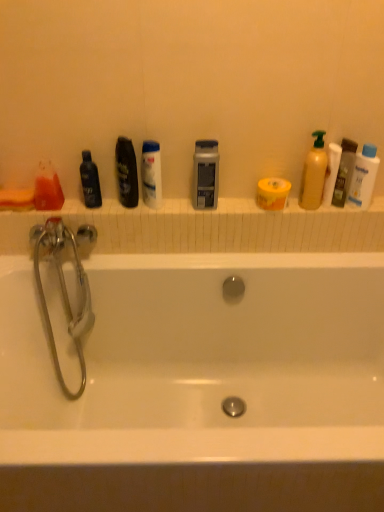
Image resolution: width=384 pixels, height=512 pixels. What do you see at coordinates (90, 181) in the screenshot?
I see `black glossy mouthwash at left, which is counted as the second mouthwash, starting from the left` at bounding box center [90, 181].

This screenshot has height=512, width=384. What are the coordinates of `white plastic baby lotion at upper right, acting as the second cleaning product starting from the left` in the screenshot? It's located at (363, 177).

I want to click on silver metallic faucet at left, so click(x=63, y=292).

Would you say matte yellow bottle at right, acting as the 2th cleaning product starting from the right, is outside satin silver mouthwash at center, the second mouthwash viewed from the right?

Yes.

Is matte yellow bottle at right, acting as the 2th cleaning product starting from the right, looking in the opposite direction of satin silver mouthwash at center, the second mouthwash viewed from the right?

No, satin silver mouthwash at center, the second mouthwash viewed from the right, is not at the back of matte yellow bottle at right, acting as the 2th cleaning product starting from the right.

Which object is closer to the camera, matte yellow bottle at right, the first cleaning product viewed from the left, or satin silver mouthwash at center, the second mouthwash viewed from the right?

Positioned in front is matte yellow bottle at right, the first cleaning product viewed from the left.

Is point (309, 163) positioned in front of point (205, 192)?

Yes, point (309, 163) is closer to viewer.

Which of these two, black glossy mouthwash at left, which is counted as the second mouthwash, starting from the left, or translucent plastic mouthwash at right, acting as the 6th mouthwash starting from the left, is bigger?

translucent plastic mouthwash at right, acting as the 6th mouthwash starting from the left, is bigger.

Find the location of a particular element. This screenshot has height=512, width=384. the 1st mouthwash in front of the black glossy mouthwash at left, which appears as the fifth mouthwash when viewed from the right is located at coordinates (344, 172).

From the image's perspective, which is below, black glossy mouthwash at left, which is counted as the second mouthwash, starting from the left, or translucent plastic mouthwash at right, acting as the 6th mouthwash starting from the left?

black glossy mouthwash at left, which is counted as the second mouthwash, starting from the left, from the image's perspective.

Who is more distant, black glossy mouthwash at left, which appears as the fifth mouthwash when viewed from the right, or translucent plastic mouthwash at right, the first mouthwash in the right-to-left sequence?

black glossy mouthwash at left, which appears as the fifth mouthwash when viewed from the right, is further from the camera.

From the image's perspective, is black matte bottle at center, the 3th mouthwash from the left, below silver metallic faucet at left?

Actually, black matte bottle at center, the 3th mouthwash from the left, appears above silver metallic faucet at left in the image.

Is black matte bottle at center, the 3th mouthwash from the left, wider or thinner than silver metallic faucet at left?

Considering their sizes, black matte bottle at center, the 3th mouthwash from the left, looks slimmer than silver metallic faucet at left.

Is black matte bottle at center, the 3th mouthwash from the left, inside the boundaries of silver metallic faucet at left, or outside?

black matte bottle at center, the 3th mouthwash from the left, exists outside the volume of silver metallic faucet at left.

Is matte yellow bottle at right, the first cleaning product viewed from the left, facing away from translucent plastic mouthwash at right, the first mouthwash in the right-to-left sequence?

matte yellow bottle at right, the first cleaning product viewed from the left, is not turned away from translucent plastic mouthwash at right, the first mouthwash in the right-to-left sequence.

Considering the relative sizes of matte yellow bottle at right, the first cleaning product viewed from the left, and translucent plastic mouthwash at right, the first mouthwash in the right-to-left sequence, in the image provided, is matte yellow bottle at right, the first cleaning product viewed from the left, taller than translucent plastic mouthwash at right, the first mouthwash in the right-to-left sequence,?

Indeed, matte yellow bottle at right, the first cleaning product viewed from the left, has a greater height compared to translucent plastic mouthwash at right, the first mouthwash in the right-to-left sequence.

How distant is matte yellow bottle at right, acting as the 2th cleaning product starting from the right, from translucent plastic mouthwash at right, acting as the 6th mouthwash starting from the left?

They are 9.31 centimeters apart.

Which is more distant, (x=317, y=198) or (x=346, y=142)?

The point (x=317, y=198) is behind.

Considering the sizes of black matte bottle at center, the 3th mouthwash from the left, and translucent orange liquid at left, the 6th mouthwash viewed from the right, in the image, is black matte bottle at center, the 3th mouthwash from the left, bigger or smaller than translucent orange liquid at left, the 6th mouthwash viewed from the right,?

black matte bottle at center, the 3th mouthwash from the left, is bigger than translucent orange liquid at left, the 6th mouthwash viewed from the right.

The height and width of the screenshot is (512, 384). There is a black matte bottle at center, placed as the 4th mouthwash when sorted from right to left. Find the location of `the 5th mouthwash below it (from a real-world perspective)`. the 5th mouthwash below it (from a real-world perspective) is located at coordinates 47,188.

Considering the sizes of objects black matte bottle at center, placed as the 4th mouthwash when sorted from right to left, and translucent orange liquid at left, the 6th mouthwash viewed from the right, in the image provided, who is shorter, black matte bottle at center, placed as the 4th mouthwash when sorted from right to left, or translucent orange liquid at left, the 6th mouthwash viewed from the right,?

translucent orange liquid at left, the 6th mouthwash viewed from the right, is shorter.

Is translucent orange liquid at left, arranged as the first mouthwash when viewed from the left, located within black matte bottle at center, placed as the 4th mouthwash when sorted from right to left?

Actually, translucent orange liquid at left, arranged as the first mouthwash when viewed from the left, is outside black matte bottle at center, placed as the 4th mouthwash when sorted from right to left.

Is matte yellow bottle at right, the first cleaning product viewed from the left, facing towards silver metallic faucet at left?

No.

Considering the sizes of matte yellow bottle at right, acting as the 2th cleaning product starting from the right, and silver metallic faucet at left in the image, is matte yellow bottle at right, acting as the 2th cleaning product starting from the right, bigger or smaller than silver metallic faucet at left?

In the image, matte yellow bottle at right, acting as the 2th cleaning product starting from the right, appears to be smaller than silver metallic faucet at left.

Is matte yellow bottle at right, acting as the 2th cleaning product starting from the right, further to the viewer compared to silver metallic faucet at left?

That is True.

Is white glossy mouthwash at center, which is counted as the third mouthwash, starting from the right, smaller than translucent plastic mouthwash at right, acting as the 6th mouthwash starting from the left?

Actually, white glossy mouthwash at center, which is counted as the third mouthwash, starting from the right, might be larger than translucent plastic mouthwash at right, acting as the 6th mouthwash starting from the left.

Is white glossy mouthwash at center, which is counted as the third mouthwash, starting from the right, shorter than translucent plastic mouthwash at right, acting as the 6th mouthwash starting from the left?

Indeed, white glossy mouthwash at center, which is counted as the third mouthwash, starting from the right, has a lesser height compared to translucent plastic mouthwash at right, acting as the 6th mouthwash starting from the left.

What's the angular difference between white glossy mouthwash at center, which appears as the fourth mouthwash when viewed from the left, and translucent plastic mouthwash at right, acting as the 6th mouthwash starting from the left,'s facing directions?

The angle between the facing direction of white glossy mouthwash at center, which appears as the fourth mouthwash when viewed from the left, and the facing direction of translucent plastic mouthwash at right, acting as the 6th mouthwash starting from the left, is 0.000373 degrees.

Is white glossy mouthwash at center, which appears as the fourth mouthwash when viewed from the left, to the right of translucent plastic mouthwash at right, acting as the 6th mouthwash starting from the left, from the viewer's perspective?

No, white glossy mouthwash at center, which appears as the fourth mouthwash when viewed from the left, is not to the right of translucent plastic mouthwash at right, acting as the 6th mouthwash starting from the left.

Locate an element on the screen. The width and height of the screenshot is (384, 512). the 2nd mouthwash below the matte yellow bottle at right, the first cleaning product viewed from the left (from a real-world perspective) is located at coordinates (205, 174).

The width and height of the screenshot is (384, 512). In order to click on the 1st mouthwash in front of the black glossy mouthwash at left, which is counted as the second mouthwash, starting from the left, counting from the anchor's position in this screenshot , I will do `click(344, 172)`.

When comparing their distances from translucent orange liquid at left, the 6th mouthwash viewed from the right, does satin silver mouthwash at center, which is counted as the fifth mouthwash, starting from the left, or translucent plastic mouthwash at right, acting as the 6th mouthwash starting from the left, seem further?

Based on the image, translucent plastic mouthwash at right, acting as the 6th mouthwash starting from the left, appears to be further to translucent orange liquid at left, the 6th mouthwash viewed from the right.

When comparing their distances from white glossy mouthwash at center, which appears as the fourth mouthwash when viewed from the left, does white plastic baby lotion at upper right, acting as the second cleaning product starting from the left, or black matte bottle at center, placed as the 4th mouthwash when sorted from right to left, seem closer?

black matte bottle at center, placed as the 4th mouthwash when sorted from right to left, is positioned closer to the anchor white glossy mouthwash at center, which appears as the fourth mouthwash when viewed from the left.

Which object lies nearer to the anchor point white glossy mouthwash at center, which appears as the fourth mouthwash when viewed from the left, matte yellow bottle at right, the first cleaning product viewed from the left, or white plastic baby lotion at upper right, the first cleaning product when ordered from right to left?

Based on the image, matte yellow bottle at right, the first cleaning product viewed from the left, appears to be nearer to white glossy mouthwash at center, which appears as the fourth mouthwash when viewed from the left.

Consider the image. From the image, which object appears to be farther from black glossy mouthwash at left, which is counted as the second mouthwash, starting from the left, matte yellow bottle at right, acting as the 2th cleaning product starting from the right, or translucent plastic mouthwash at right, acting as the 6th mouthwash starting from the left?

translucent plastic mouthwash at right, acting as the 6th mouthwash starting from the left.

Which object lies further to the anchor point black glossy mouthwash at left, which appears as the fifth mouthwash when viewed from the right, white glossy mouthwash at center, which appears as the fourth mouthwash when viewed from the left, or black matte bottle at center, the 3th mouthwash from the left?

white glossy mouthwash at center, which appears as the fourth mouthwash when viewed from the left, is positioned further to the anchor black glossy mouthwash at left, which appears as the fifth mouthwash when viewed from the right.

Which object lies nearer to the anchor point white plastic baby lotion at upper right, acting as the second cleaning product starting from the left, translucent plastic mouthwash at right, the first mouthwash in the right-to-left sequence, or matte yellow bottle at right, the first cleaning product viewed from the left?

translucent plastic mouthwash at right, the first mouthwash in the right-to-left sequence, lies closer to white plastic baby lotion at upper right, acting as the second cleaning product starting from the left, than the other object.

Based on the photo, which object lies nearer to the anchor point black matte bottle at center, placed as the 4th mouthwash when sorted from right to left, matte yellow bottle at right, the first cleaning product viewed from the left, or white glossy mouthwash at center, which appears as the fourth mouthwash when viewed from the left?

white glossy mouthwash at center, which appears as the fourth mouthwash when viewed from the left.

When comparing their distances from translucent orange liquid at left, the 6th mouthwash viewed from the right, does black glossy mouthwash at left, which is counted as the second mouthwash, starting from the left, or translucent plastic mouthwash at right, the first mouthwash in the right-to-left sequence, seem further?

Based on the image, translucent plastic mouthwash at right, the first mouthwash in the right-to-left sequence, appears to be further to translucent orange liquid at left, the 6th mouthwash viewed from the right.

This screenshot has width=384, height=512. Find the location of `tap situated between translucent orange liquid at left, arranged as the first mouthwash when viewed from the left, and white plastic baby lotion at upper right, acting as the second cleaning product starting from the left, from left to right`. tap situated between translucent orange liquid at left, arranged as the first mouthwash when viewed from the left, and white plastic baby lotion at upper right, acting as the second cleaning product starting from the left, from left to right is located at coordinates (63, 292).

Locate an element on the screen. cleaning product between satin silver mouthwash at center, the second mouthwash viewed from the right, and translucent plastic mouthwash at right, acting as the 6th mouthwash starting from the left, from left to right is located at coordinates (314, 174).

You are a GUI agent. You are given a task and a screenshot of the screen. Output one action in this format:
    pyautogui.click(x=<x>, y=<y>)
    Task: Click on the cleaning product between silver metallic faucet at left and white plastic baby lotion at upper right, acting as the second cleaning product starting from the left, from left to right
    
    Given the screenshot: What is the action you would take?
    pyautogui.click(x=314, y=174)

I want to click on mouthwash located between translucent orange liquid at left, arranged as the first mouthwash when viewed from the left, and black matte bottle at center, placed as the 4th mouthwash when sorted from right to left, in the left-right direction, so click(90, 181).